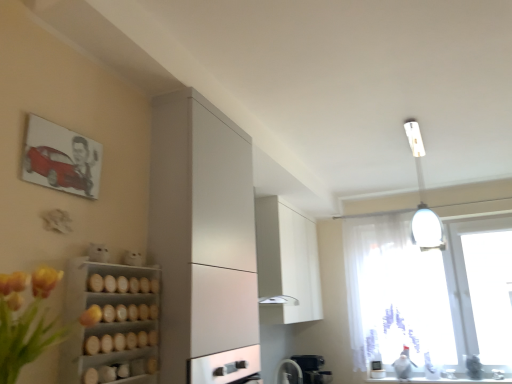
You are a GUI agent. You are given a task and a screenshot of the screen. Output one action in this format:
    pyautogui.click(x=<x>, y=<y>)
    Task: Click on the satin white cabinet at left, positioned as the 1th cabinetry in left-to-right order
    The width and height of the screenshot is (512, 384).
    Given the screenshot: What is the action you would take?
    pyautogui.click(x=201, y=231)

Image resolution: width=512 pixels, height=384 pixels. I want to click on white glossy light fixture at upper right, so click(422, 198).

Identify the location of white glossy counter top at lower right. This screenshot has height=384, width=512. (437, 381).

Find the location of `satin black coffee machine at lower center`. satin black coffee machine at lower center is located at coordinates (311, 368).

Is white matte cabinet at upper center, positioned as the 2th cabinetry in front-to-back order, facing away from white glossy fan at lower center?

No, white matte cabinet at upper center, positioned as the 2th cabinetry in front-to-back order,'s orientation is not away from white glossy fan at lower center.

Measure the distance between white matte cabinet at upper center, which ranks as the first cabinetry in right-to-left order, and white glossy fan at lower center.

They are 83.53 centimeters apart.

From a real-world perspective, which cabinetry is the 2nd one above the white glossy fan at lower center? Please provide its 2D coordinates.

[(286, 264)]

Considering the positions of points (267, 282) and (287, 360), is point (267, 282) closer to camera compared to point (287, 360)?

Yes, it is in front of point (287, 360).

Is transparent fabric at right facing away from satin white cabinet at left, which is the second cabinetry in right-to-left order?

No, transparent fabric at right is not facing the opposite direction of satin white cabinet at left, which is the second cabinetry in right-to-left order.

At what (x,y) coordinates should I click in order to perform the action: click on cabinetry that is the 2nd one when counting leftward from the transparent fabric at right. Please return your answer as a coordinate pair (x, y). Looking at the image, I should click on (201, 231).

Which of these two, transparent fabric at right or satin white cabinet at left, which is the second cabinetry in right-to-left order, is smaller?

With smaller size is transparent fabric at right.

From the image's perspective, relative to satin white cabinet at left, the first cabinetry viewed from the front, is transparent fabric at right above or below?

Clearly, from the image's perspective, transparent fabric at right is below satin white cabinet at left, the first cabinetry viewed from the front.

Is satin white cabinet at left, the first cabinetry viewed from the front, bigger or smaller than white glossy light fixture at upper right?

In the image, satin white cabinet at left, the first cabinetry viewed from the front, appears to be larger than white glossy light fixture at upper right.

From the image's perspective, which is below, satin white cabinet at left, which is counted as the second cabinetry, starting from the back, or white glossy light fixture at upper right?

satin white cabinet at left, which is counted as the second cabinetry, starting from the back.

From a real-world perspective, which object rests below the other?

satin white cabinet at left, the first cabinetry viewed from the front, is physically lower.

Is yellow artificial flowers at left at the left side of white matte cabinet at upper center, which ranks as the first cabinetry in right-to-left order?

Correct, you'll find yellow artificial flowers at left to the left of white matte cabinet at upper center, which ranks as the first cabinetry in right-to-left order.

Who is smaller, yellow artificial flowers at left or white matte cabinet at upper center, which ranks as the first cabinetry in right-to-left order?

yellow artificial flowers at left.

From the image's perspective, is yellow artificial flowers at left over white matte cabinet at upper center, positioned as the 2th cabinetry in front-to-back order?

Yes, from the image's perspective, yellow artificial flowers at left is over white matte cabinet at upper center, positioned as the 2th cabinetry in front-to-back order.

You are a GUI agent. You are given a task and a screenshot of the screen. Output one action in this format:
    pyautogui.click(x=<x>, y=<y>)
    Task: Click on the cabinetry below the yellow artificial flowers at left (from the image's perspective)
    
    Given the screenshot: What is the action you would take?
    pyautogui.click(x=286, y=264)

Is white glossy light fixture at upper right next to wooden shelves at lower left and touching it?

No, white glossy light fixture at upper right is not beside wooden shelves at lower left.

From the image's perspective, is white glossy light fixture at upper right located beneath wooden shelves at lower left?

Incorrect, from the image's perspective, white glossy light fixture at upper right is higher than wooden shelves at lower left.

Considering the positions of objects white glossy light fixture at upper right and wooden shelves at lower left in the image provided, who is in front, white glossy light fixture at upper right or wooden shelves at lower left?

wooden shelves at lower left is more forward.

Considering the points (426, 228) and (121, 365), which point is behind, point (426, 228) or point (121, 365)?

The point (426, 228) is farther.

Consider the image. Considering the relative sizes of transparent fabric at right and white glossy light fixture at upper right in the image provided, is transparent fabric at right wider than white glossy light fixture at upper right?

Incorrect, the width of transparent fabric at right does not surpass that of white glossy light fixture at upper right.

Does transparent fabric at right have a lesser height compared to white glossy light fixture at upper right?

Incorrect, the height of transparent fabric at right does not fall short of that of white glossy light fixture at upper right.

Is transparent fabric at right not close to white glossy light fixture at upper right?

No, transparent fabric at right is not far from white glossy light fixture at upper right.

From a real-world perspective, is satin black coffee machine at lower center physically below white glossy fan at lower center?

Correct, in the physical world, satin black coffee machine at lower center is lower than white glossy fan at lower center.

Is white glossy fan at lower center a part of satin black coffee machine at lower center?

Definitely not — white glossy fan at lower center is not inside satin black coffee machine at lower center.

Can you confirm if satin black coffee machine at lower center is bigger than white glossy fan at lower center?

Yes.

Find the location of `appliance located below the white matte cabinet at upper center, positioned as the 2th cabinetry in front-to-back order (from the image's perspective)`. appliance located below the white matte cabinet at upper center, positioned as the 2th cabinetry in front-to-back order (from the image's perspective) is located at coordinates (289, 372).

You are a GUI agent. You are given a task and a screenshot of the screen. Output one action in this format:
    pyautogui.click(x=<x>, y=<y>)
    Task: Click on the cabinetry that is the 2nd one when counting leftward from the transparent fabric at right
    
    Given the screenshot: What is the action you would take?
    pyautogui.click(x=201, y=231)

Considering their positions, is satin white cabinet at left, positioned as the 1th cabinetry in left-to-right order, positioned closer to transparent fabric at right than wooden shelves at lower left?

satin white cabinet at left, positioned as the 1th cabinetry in left-to-right order, is closer to transparent fabric at right.

Estimate the real-world distances between objects in this image. Which object is closer to wooden shelves at lower left, satin white cabinet at left, positioned as the 1th cabinetry in left-to-right order, or satin black coffee machine at lower center?

Among the two, satin white cabinet at left, positioned as the 1th cabinetry in left-to-right order, is located nearer to wooden shelves at lower left.

Estimate the real-world distances between objects in this image. Which object is closer to transparent fabric at right, white glossy light fixture at upper right or wooden shelves at lower left?

white glossy light fixture at upper right.

Considering their positions, is wooden shelves at lower left positioned further to satin black coffee machine at lower center than satin white cabinet at left, the first cabinetry viewed from the front?

wooden shelves at lower left is further to satin black coffee machine at lower center.

Looking at the image, which one is located closer to satin black coffee machine at lower center, wooden shelves at lower left or white glossy counter top at lower right?

white glossy counter top at lower right.

Estimate the real-world distances between objects in this image. Which object is closer to satin black coffee machine at lower center, satin white cabinet at left, which is counted as the second cabinetry, starting from the back, or white matte cabinet at upper center, which ranks as the first cabinetry in right-to-left order?

white matte cabinet at upper center, which ranks as the first cabinetry in right-to-left order.

Looking at this image, from the image, which object appears to be farther from satin white cabinet at left, positioned as the 1th cabinetry in left-to-right order, satin black coffee machine at lower center or white glossy counter top at lower right?

white glossy counter top at lower right is positioned further to the anchor satin white cabinet at left, positioned as the 1th cabinetry in left-to-right order.

Which object lies further to the anchor point wooden shelves at lower left, white glossy counter top at lower right or white glossy fan at lower center?

white glossy counter top at lower right.

You are a GUI agent. You are given a task and a screenshot of the screen. Output one action in this format:
    pyautogui.click(x=<x>, y=<y>)
    Task: Click on the window positioned between wooden shelves at lower left and satin black coffee machine at lower center from near to far
    This screenshot has width=512, height=384.
    Given the screenshot: What is the action you would take?
    pyautogui.click(x=407, y=290)

Where is `coffee machine situated between white matte cabinet at upper center, which ranks as the first cabinetry in right-to-left order, and transparent fabric at right from left to right`? coffee machine situated between white matte cabinet at upper center, which ranks as the first cabinetry in right-to-left order, and transparent fabric at right from left to right is located at coordinates (311, 368).

Image resolution: width=512 pixels, height=384 pixels. Identify the location of shelf positioned between yellow artificial flowers at left and satin white cabinet at left, the first cabinetry viewed from the front, from near to far. (112, 322).

In order to click on light fixture between yellow artificial flowers at left and white glossy counter top at lower right along the z-axis in this screenshot , I will do `click(422, 198)`.